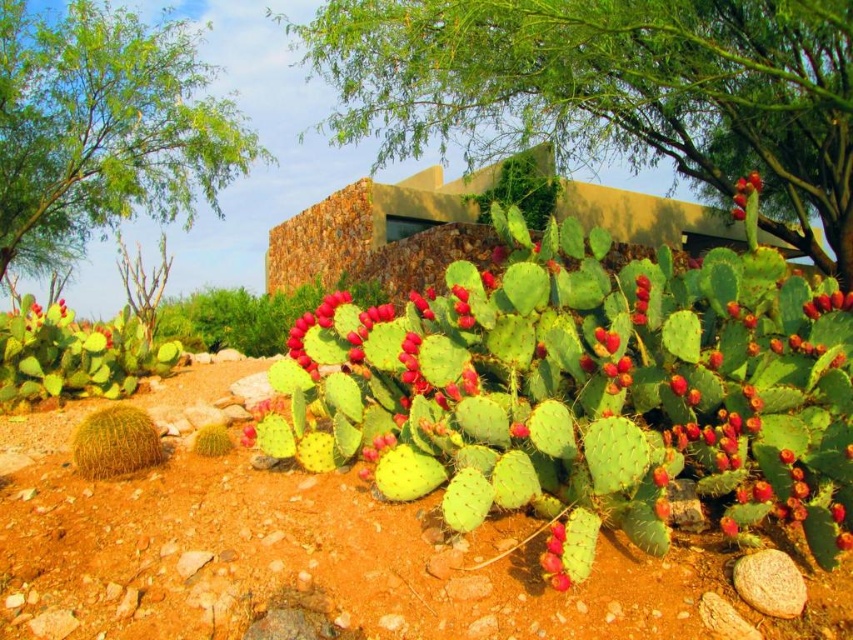
Question: Observing the image, what is the correct spatial positioning of green spiny cactus at lower left in reference to red matte prickly pear cactus at center?

Choices:
 (A) above
 (B) below

Answer: (B)

Question: Which point is closer to the camera?

Choices:
 (A) (300, 365)
 (B) (805, 308)
 (C) (132, 378)

Answer: (B)

Question: Is green leafy tree at upper left to the left of green spiny cactus at lower left from the viewer's perspective?

Choices:
 (A) no
 (B) yes

Answer: (B)

Question: Is green leafy tree at upper left smaller than red matte prickly pear cactus at lower center?

Choices:
 (A) no
 (B) yes

Answer: (A)

Question: Which object is positioned farthest from the green leafy tree at upper center?

Choices:
 (A) red matte prickly pear cactus at lower center
 (B) red matte prickly pear cactus at center
 (C) green leafy tree at upper left

Answer: (A)

Question: Which is farther from the red matte prickly pear cactus at center?

Choices:
 (A) smooth red cactus fruit at center
 (B) glossy red prickly pear cactus at upper right
 (C) green leafy tree at upper center

Answer: (C)